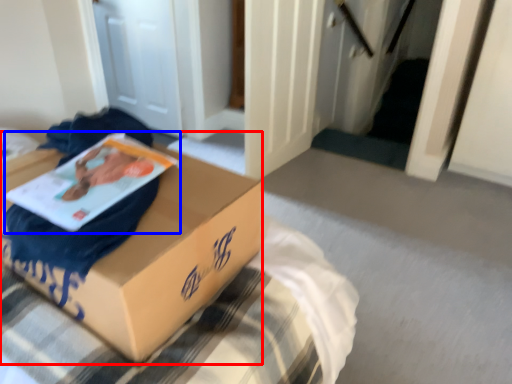
Question: Which object is closer to the camera taking this photo, box (highlighted by a red box) or paperback book (highlighted by a blue box)?

Choices:
 (A) box
 (B) paperback book

Answer: (A)